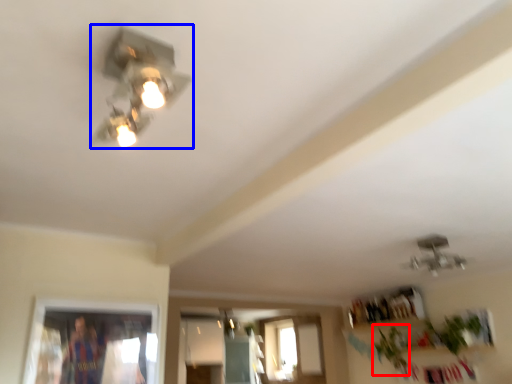
Question: Which point is closer to the camera, plant (highlighted by a red box) or lamp (highlighted by a blue box)?

Choices:
 (A) plant
 (B) lamp

Answer: (B)